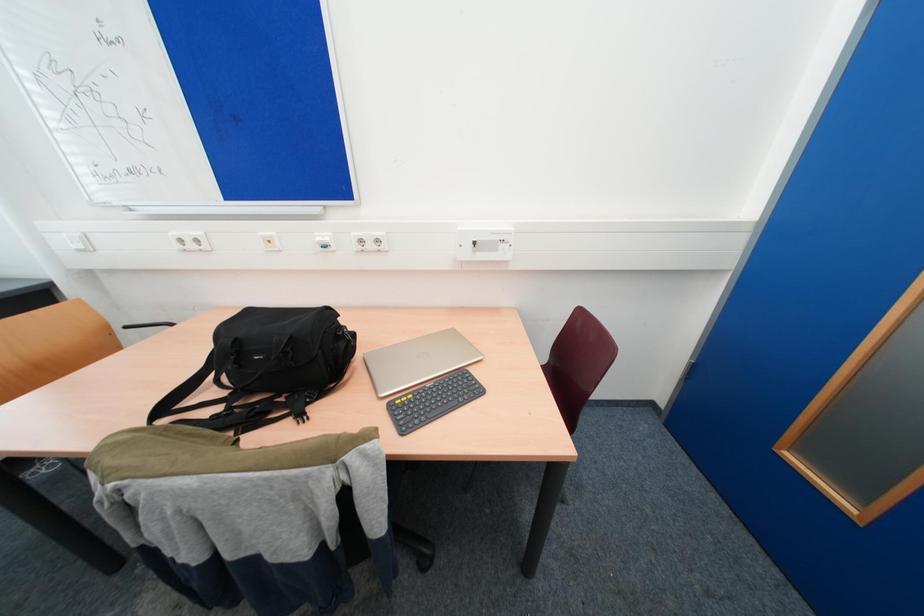
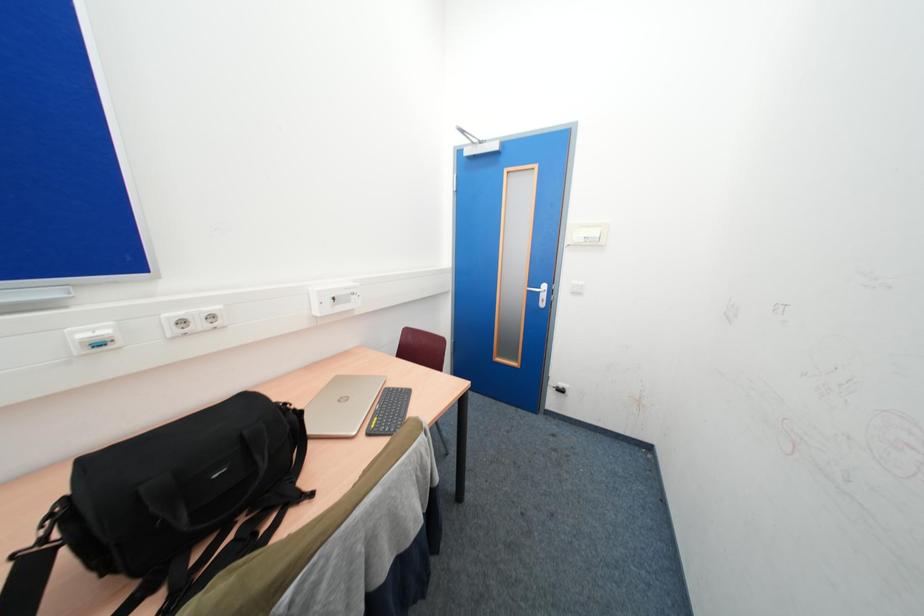
Question: The images are taken continuously from a first-person perspective. In which direction is your viewpoint rotating?

Choices:
 (A) Left
 (B) Right
 (C) Up
 (D) Down

Answer: (B)